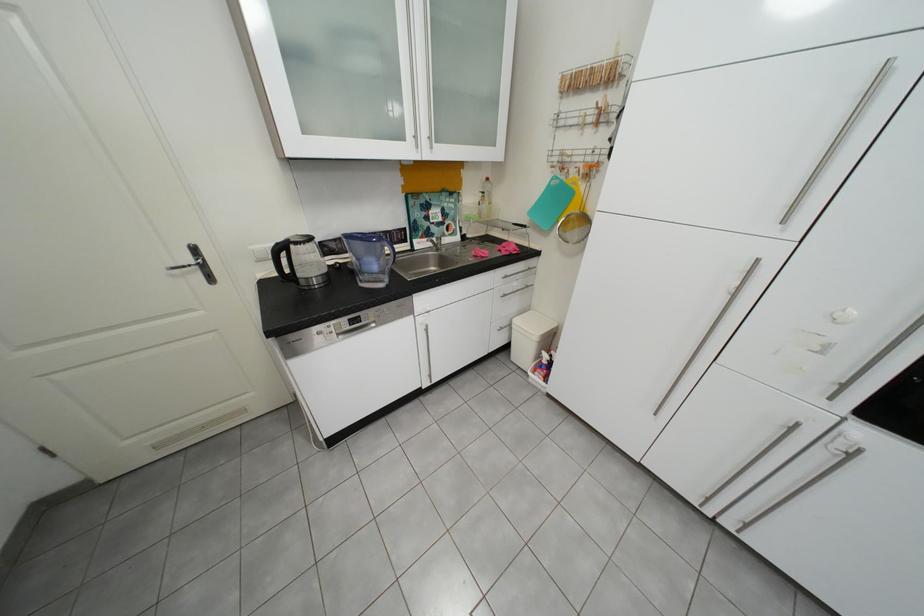
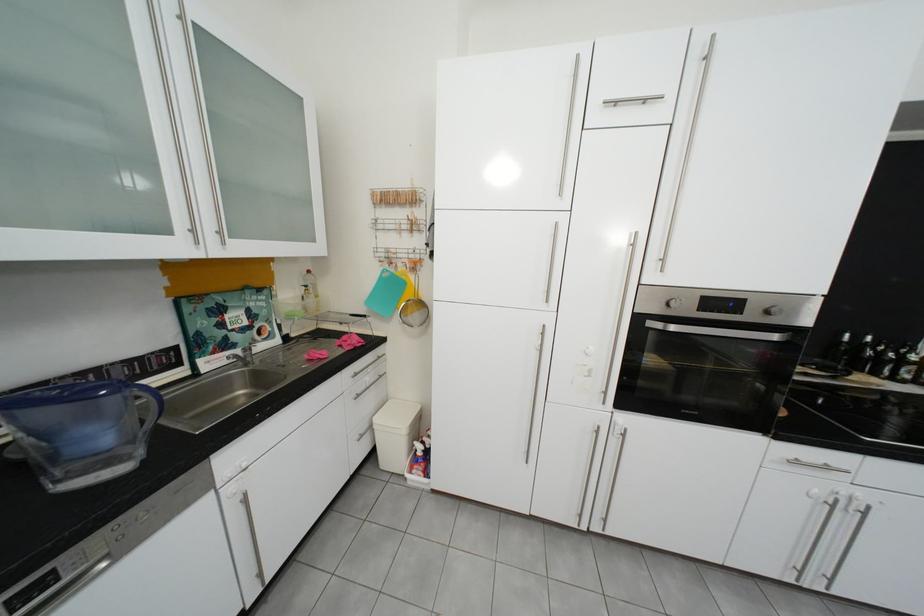
Question: I am providing you with two images of the same scene from different viewpoints. After the viewpoint changes to image2, which objects are now occluded?

Choices:
 (A) dark glass bottle
 (B) silver oven handle
 (C) white spray bottle
 (D) none of these

Answer: (D)